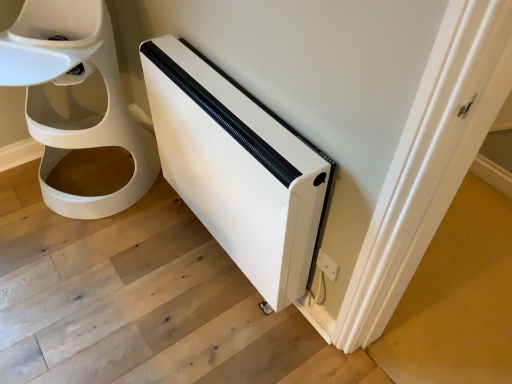
Question: From a real-world perspective, is white plastic electric outlet at lower right on top of white matte heater at lower right?

Choices:
 (A) yes
 (B) no

Answer: (B)

Question: From a real-world perspective, does white plastic electric outlet at lower right sit lower than white matte heater at lower right?

Choices:
 (A) yes
 (B) no

Answer: (A)

Question: Is white plastic electric outlet at lower right bigger than white matte heater at lower right?

Choices:
 (A) no
 (B) yes

Answer: (A)

Question: Is white plastic electric outlet at lower right behind white matte heater at lower right?

Choices:
 (A) yes
 (B) no

Answer: (A)

Question: Is white plastic electric outlet at lower right smaller than white matte heater at lower right?

Choices:
 (A) yes
 (B) no

Answer: (A)

Question: Is white plastic electric outlet at lower right thinner than white matte heater at lower right?

Choices:
 (A) no
 (B) yes

Answer: (B)

Question: Considering the relative sizes of white plastic electric outlet at lower right and white matte heater at lower right in the image provided, is white plastic electric outlet at lower right taller than white matte heater at lower right?

Choices:
 (A) no
 (B) yes

Answer: (A)

Question: Is white plastic electric outlet at lower right oriented towards white matte heater at lower right?

Choices:
 (A) yes
 (B) no

Answer: (B)

Question: Considering the relative positions of white plastic electric outlet at lower right and white matte heater at lower right in the image provided, is white plastic electric outlet at lower right behind white matte heater at lower right?

Choices:
 (A) yes
 (B) no

Answer: (A)

Question: Are white plastic electric outlet at lower right and white matte heater at lower right making contact?

Choices:
 (A) no
 (B) yes

Answer: (A)

Question: Can you confirm if white plastic electric outlet at lower right is wider than white matte heater at lower right?

Choices:
 (A) no
 (B) yes

Answer: (A)

Question: Considering the relative sizes of white plastic electric outlet at lower right and white matte heater at lower right in the image provided, is white plastic electric outlet at lower right smaller than white matte heater at lower right?

Choices:
 (A) no
 (B) yes

Answer: (B)

Question: From the image's perspective, is white matte heater at lower right located beneath white matte heater at lower right?

Choices:
 (A) yes
 (B) no

Answer: (A)